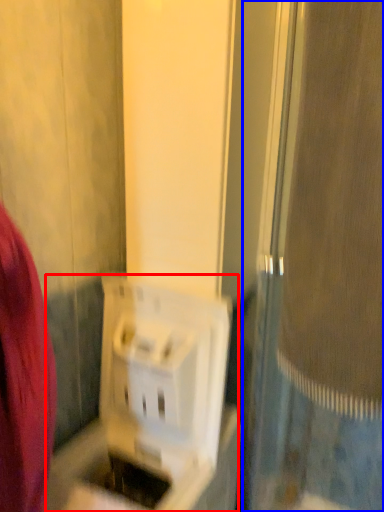
Question: Which of the following is the closest to the observer, appliance (highlighted by a red box) or screen door (highlighted by a blue box)?

Choices:
 (A) appliance
 (B) screen door

Answer: (B)